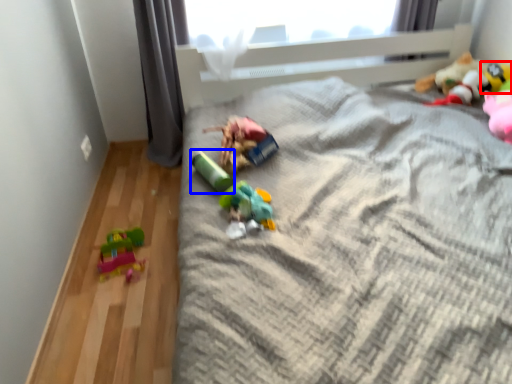
Question: Which point is further to the camera, toy (highlighted by a red box) or toy (highlighted by a blue box)?

Choices:
 (A) toy
 (B) toy

Answer: (A)